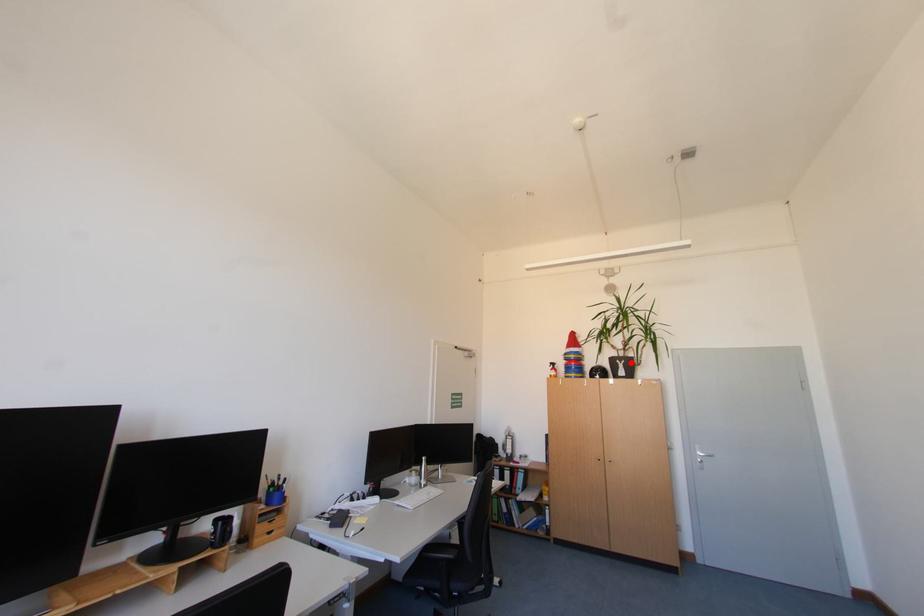
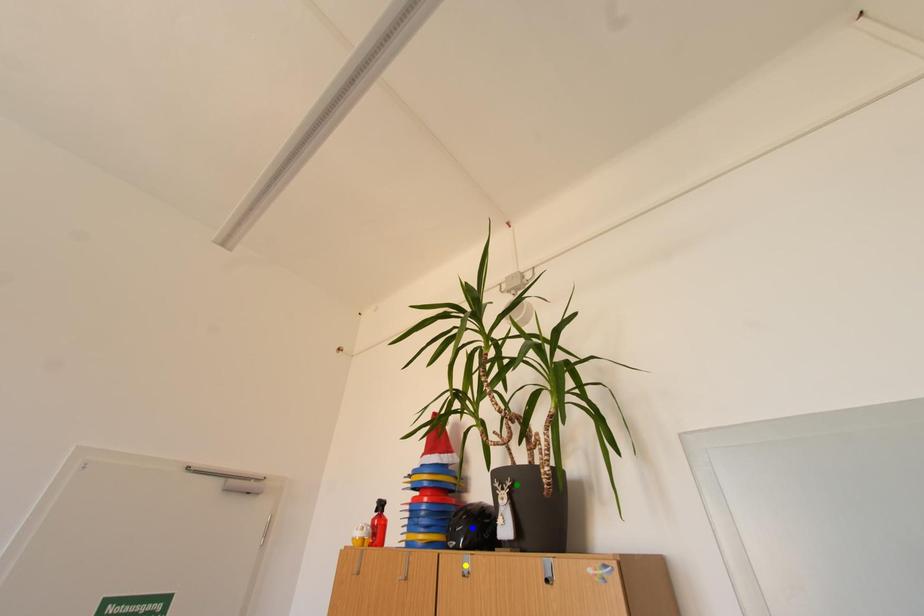
Question: I am providing you with two images of the same scene from different viewpoints. A red point is marked on the first image. You are given multiple points on the second image. Can you choose the point in image 2 that corresponds to the point in image 1?

Choices:
 (A) blue point
 (B) green point
 (C) yellow point

Answer: (B)